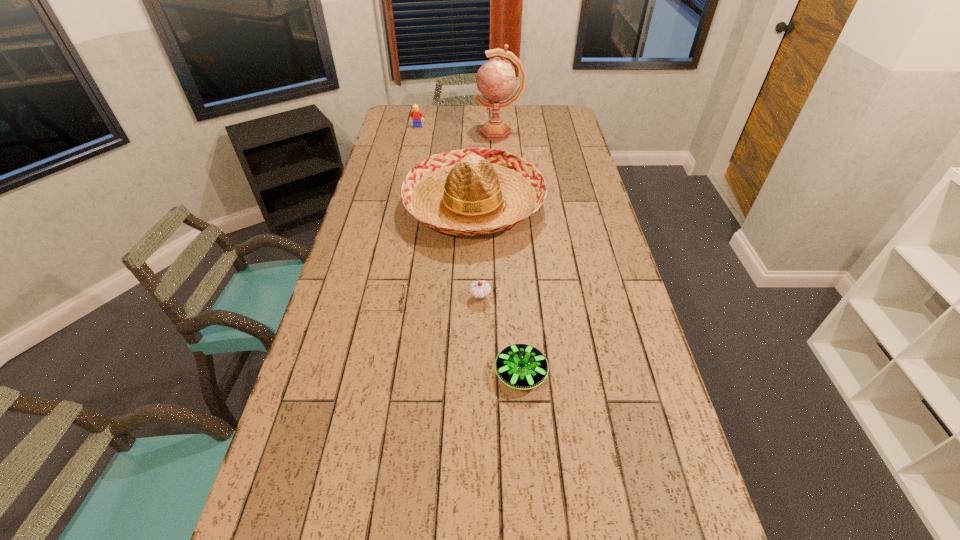
I want to click on free space located on the front-facing side of the tallest object, so click(x=390, y=133).

This screenshot has height=540, width=960. I want to click on vacant space situated on the back of the third farthest object, so click(475, 159).

Identify the location of free location located on the face of the Lego. (411, 157).

Locate an element on the screen. This screenshot has height=540, width=960. vacant space located on the right of the cupcake is located at coordinates (591, 297).

Where is `vacant space positioned on the front of the fifth tallest object`? vacant space positioned on the front of the fifth tallest object is located at coordinates (534, 539).

Image resolution: width=960 pixels, height=540 pixels. I want to click on free location located 0.100m on the front-facing side of the shortest object, so click(x=436, y=303).

Identify the location of globe located at the far edge. This screenshot has height=540, width=960. (496, 81).

Where is `Lego situated at the far edge`? Lego situated at the far edge is located at coordinates (416, 115).

This screenshot has width=960, height=540. In order to click on Lego at the left edge in this screenshot , I will do `click(416, 115)`.

I want to click on sunglasses located at the left edge, so click(403, 289).